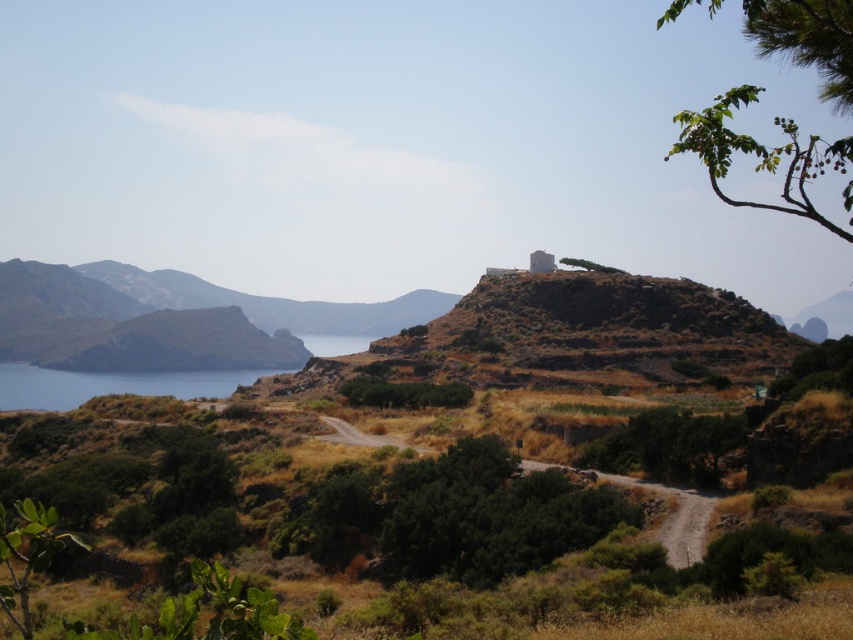
You are an explorer in this landscape and need to determine which object is taller between the green leafy branch at upper right and the blue water at lower left. Based on the scene, can you identify which one is taller?

The green leafy branch at upper right is taller than the blue water at lower left according to the description.

You are an archaeologist examining the landscape. You notice a green leafy branch at upper right. Based on its position, can you estimate where it is located in the image? Please provide coordinates in the format of a point between 0 and 1 in both x and y axes.

The green leafy branch at upper right is located at coordinates approximately at point 0.245 in the x axis and 0.899 in the y axis.